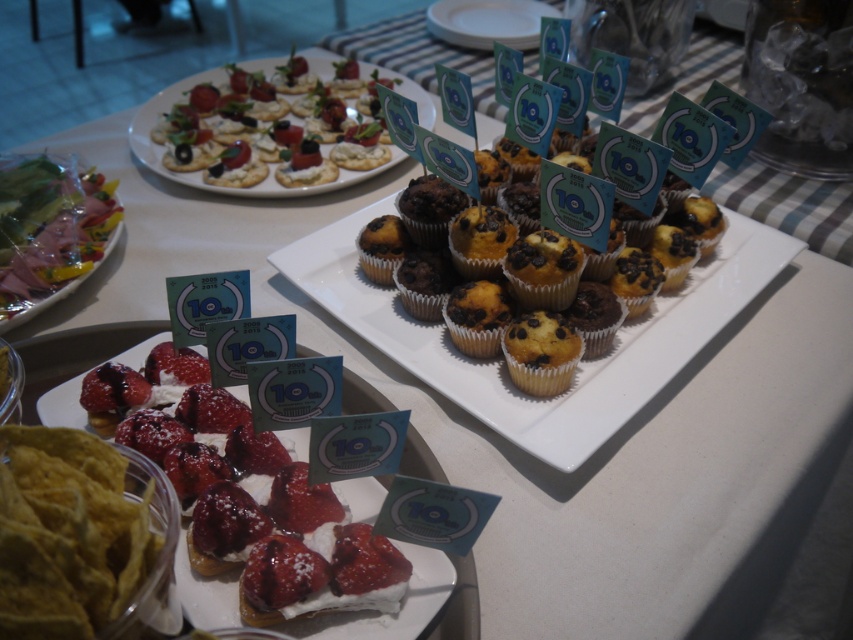
Question: Among these points, which one is farthest from the camera?

Choices:
 (A) (97, 209)
 (B) (630, 280)
 (C) (387, 477)
 (D) (531, 16)

Answer: (D)

Question: Is yellow cake-like muffins at center positioned behind strawberry-topped pastries at center?

Choices:
 (A) no
 (B) yes

Answer: (B)

Question: Which point is farther to the camera?

Choices:
 (A) white glossy plate at upper center
 (B) yellow cake-like muffins at center
 (C) clear plastic tray at upper left
 (D) matte white crackers at upper left

Answer: (A)

Question: Among these objects, which one is nearest to the camera?

Choices:
 (A) strawberry-topped pastries at center
 (B) yellow cake with chocolate chips at center
 (C) white glossy plate at upper center
 (D) matte white crackers at upper left

Answer: (A)

Question: Is yellow cake-like muffins at center closer to camera compared to white glossy plate at upper center?

Choices:
 (A) yes
 (B) no

Answer: (A)

Question: Does clear plastic tray at upper left have a lesser width compared to strawberry-topped pastries at center?

Choices:
 (A) no
 (B) yes

Answer: (B)